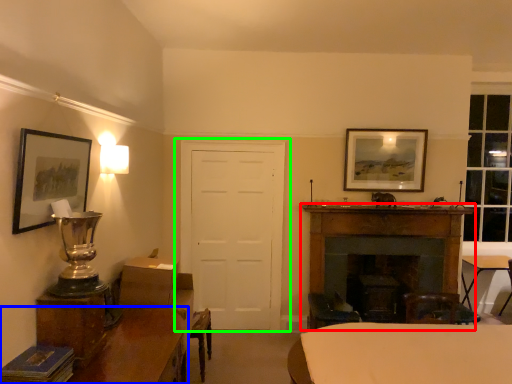
Question: Considering the real-world distances, which object is closest to fireplace (highlighted by a red box)? table (highlighted by a blue box) or door (highlighted by a green box).

Choices:
 (A) table
 (B) door

Answer: (B)